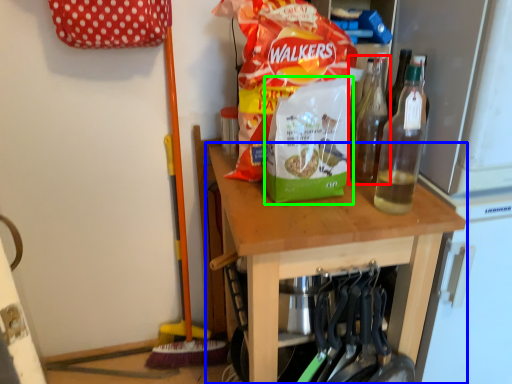
Question: Which object is the farthest from bottle (highlighted by a red box)? Choose among these: table (highlighted by a blue box) or waste (highlighted by a green box).

Choices:
 (A) table
 (B) waste

Answer: (A)